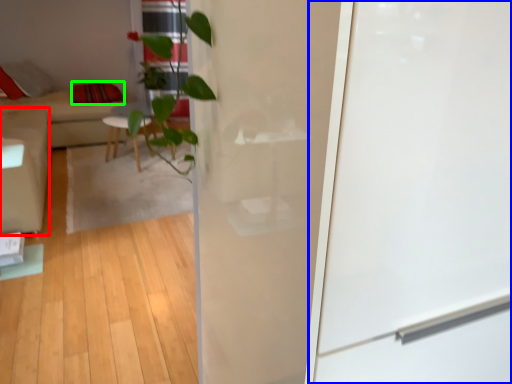
Question: Considering the real-world distances, which object is farthest from armchair (highlighted by a red box)? screen door (highlighted by a blue box) or pillow (highlighted by a green box)?

Choices:
 (A) screen door
 (B) pillow

Answer: (A)